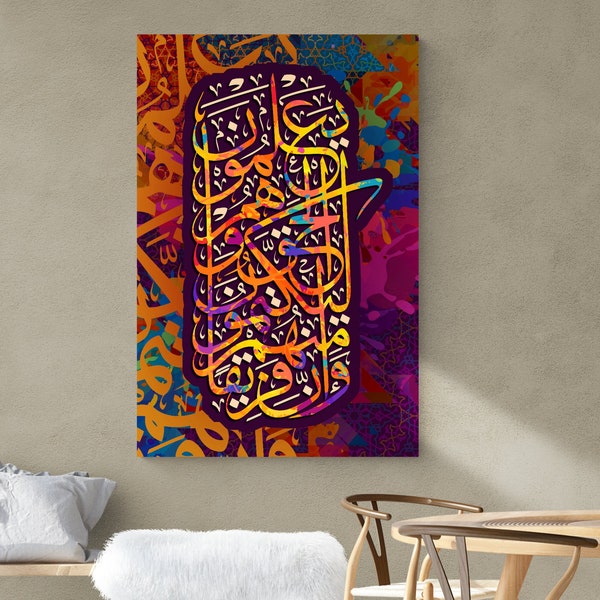
Identify the location of art work. (274, 241).